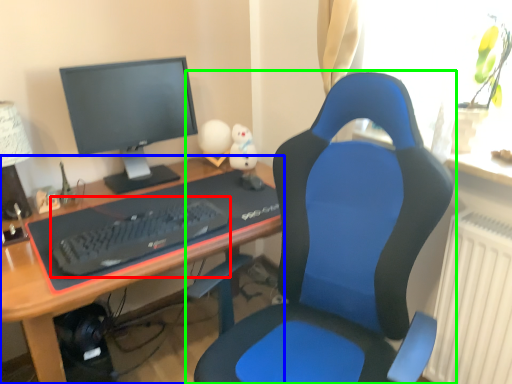
Question: Which object is the closest to the computer keyboard (highlighted by a red box)? Choose among these: desk (highlighted by a blue box) or chair (highlighted by a green box).

Choices:
 (A) desk
 (B) chair

Answer: (A)